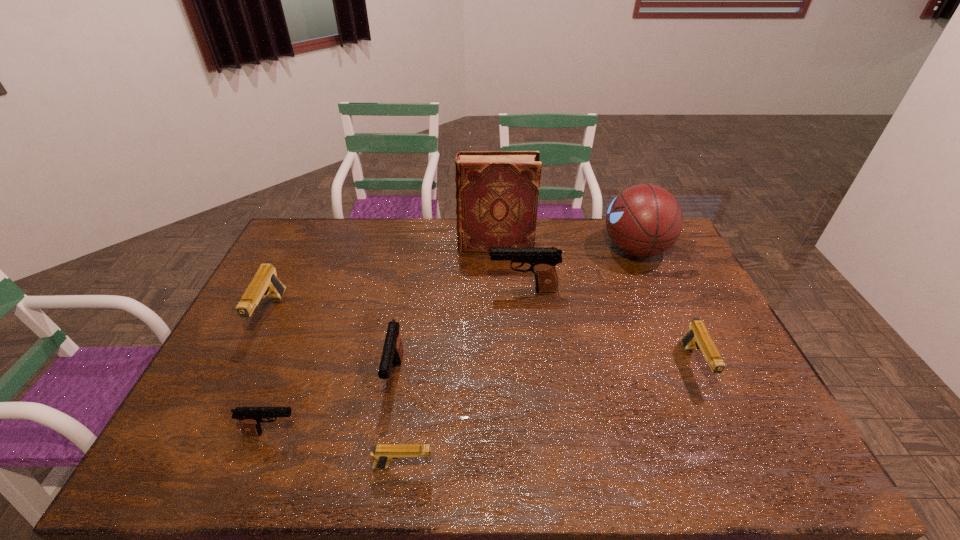
Locate an element on the screen. This screenshot has height=540, width=960. vacant position located at the barrel of the rightmost black pistol is located at coordinates (449, 290).

Locate an element on the screen. The image size is (960, 540). vacant point located 0.350m at the barrel of the leftmost pistol is located at coordinates (199, 460).

You are a GUI agent. You are given a task and a screenshot of the screen. Output one action in this format:
    pyautogui.click(x=<x>, y=<y>)
    Task: Click on the vacant space located 0.180m at the barrel of the second black pistol from left to right
    
    Given the screenshot: What is the action you would take?
    pyautogui.click(x=377, y=476)

You are a GUI agent. You are given a task and a screenshot of the screen. Output one action in this format:
    pyautogui.click(x=<x>, y=<y>)
    Task: Click on the free space located 0.090m at the barrel of the rightmost tan pistol
    
    Given the screenshot: What is the action you would take?
    pyautogui.click(x=721, y=425)

Locate an element on the screen. The image size is (960, 540). vacant space located 0.320m at the barrel of the leftmost black pistol is located at coordinates (434, 433).

Find the location of `free region located at the barrel of the second tan pistol from right to left`. free region located at the barrel of the second tan pistol from right to left is located at coordinates (588, 467).

Identify the location of hardback book at the far edge. (497, 192).

Locate an element on the screen. This screenshot has height=540, width=960. basketball that is at the far edge is located at coordinates (644, 220).

Find the location of a particular element. This screenshot has width=960, height=540. object that is at the near edge is located at coordinates (383, 453).

Locate an element on the screen. basketball at the right edge is located at coordinates (644, 220).